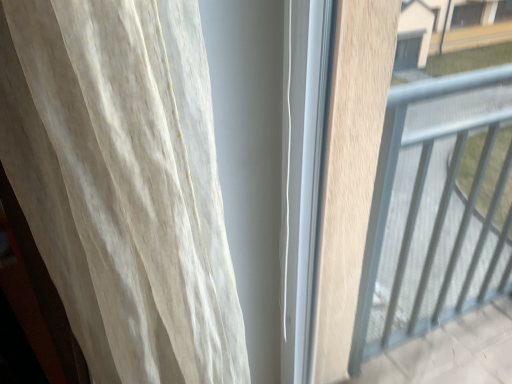
What do you see at coordinates (428, 212) in the screenshot? Image resolution: width=512 pixels, height=384 pixels. I see `metallic gray railing at right` at bounding box center [428, 212].

Where is `metallic gray railing at right`? metallic gray railing at right is located at coordinates (428, 212).

Find the location of `metallic gray railing at right`. metallic gray railing at right is located at coordinates (428, 212).